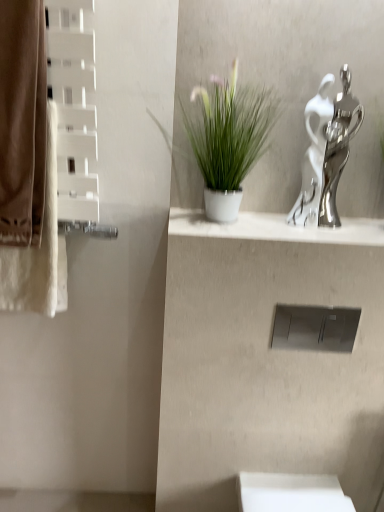
Question: From the image's perspective, is brown cotton bath towel at left above or below silver metallic sculpture at upper right?

Choices:
 (A) below
 (B) above

Answer: (A)

Question: From a real-world perspective, is brown cotton bath towel at left positioned above or below silver metallic sculpture at upper right?

Choices:
 (A) above
 (B) below

Answer: (B)

Question: Based on their relative distances, which object is farther from the white glossy vase at upper center?

Choices:
 (A) green matte plant at center
 (B) silver metallic sculpture at upper right
 (C) brown fabric curtain at left
 (D) brown cotton bath towel at left

Answer: (C)

Question: Which object is the farthest from the brown cotton bath towel at left?

Choices:
 (A) white glossy vase at upper center
 (B) silver metallic sculpture at upper right
 (C) green matte plant at center
 (D) brown fabric curtain at left

Answer: (B)